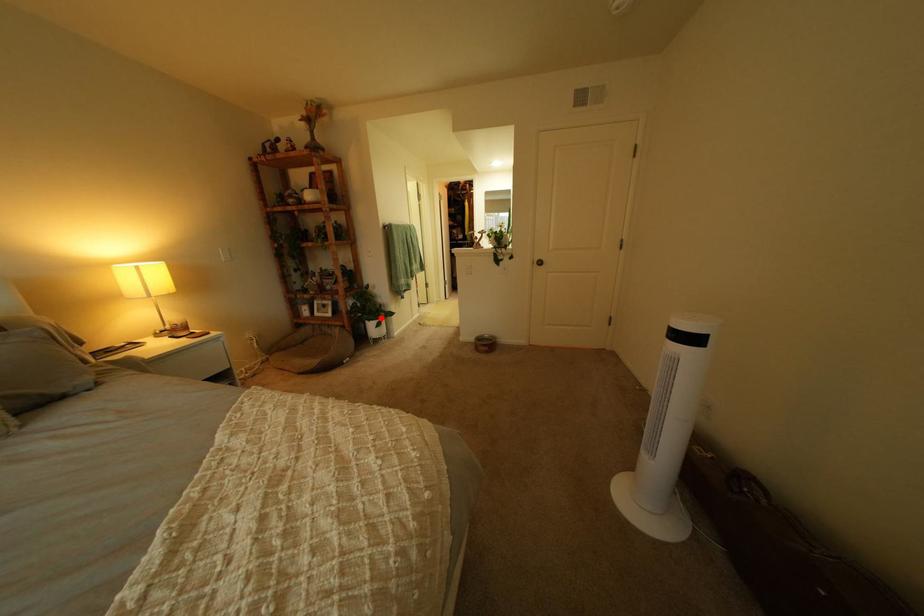
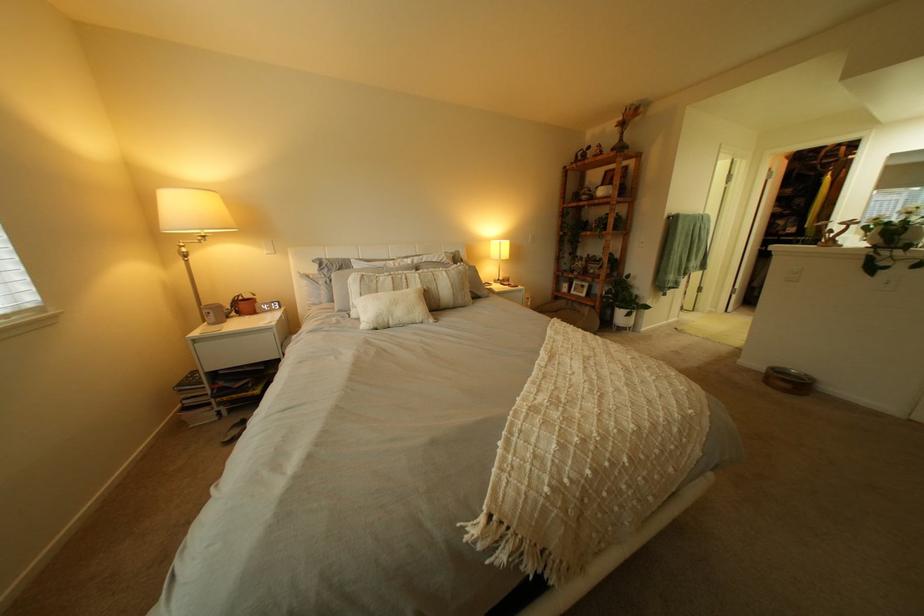
Question: A red point is marked in image1. In image2, is the corresponding 3D point closer to the camera or farther? Reply with the corresponding letter.

Choices:
 (A) The corresponding 3D point is closer.
 (B) The corresponding 3D point is farther.

Answer: (A)